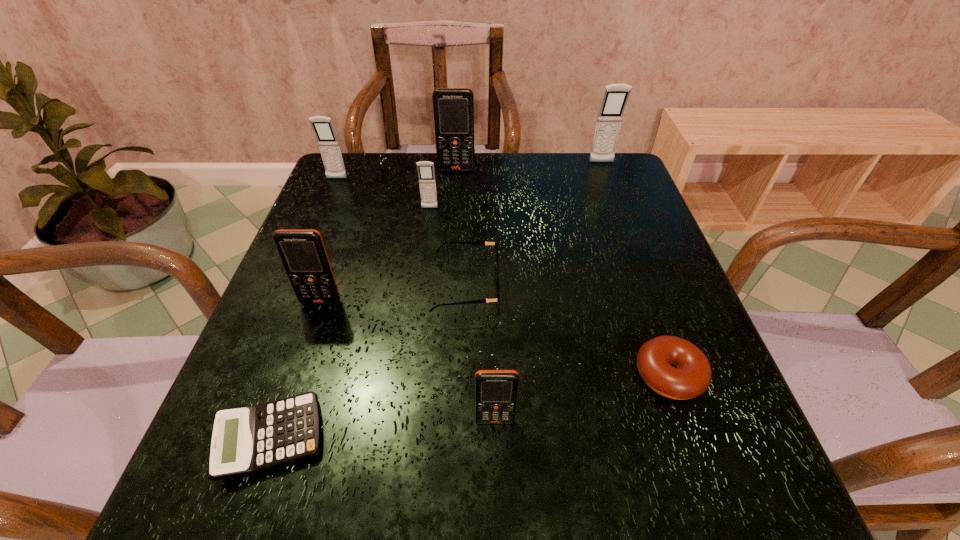
Identify the location of free area in between the chocolate doughnut and the farthest gray cellular telephone. The image size is (960, 540). (636, 269).

Where is `free spot between the farthest cellular telephone and the shortest object`? The height and width of the screenshot is (540, 960). free spot between the farthest cellular telephone and the shortest object is located at coordinates (436, 300).

Locate an element on the screen. Image resolution: width=960 pixels, height=540 pixels. free space between the fourth farthest object and the chocolate doughnut is located at coordinates (549, 292).

The width and height of the screenshot is (960, 540). In order to click on free space that is in between the spectacles and the shortest object in this screenshot , I will do `click(368, 362)`.

Identify the location of free spot between the third farthest cellular telephone and the doughnut. The height and width of the screenshot is (540, 960). (503, 277).

Where is `free space between the second farthest gray cellular telephone and the eighth nearest object`? free space between the second farthest gray cellular telephone and the eighth nearest object is located at coordinates (396, 174).

At what (x,y) coordinates should I click in order to perform the action: click on blank region between the leftmost gray cellular telephone and the second farthest cellular telephone. Please return your answer as a coordinate pair (x, y). The image size is (960, 540). Looking at the image, I should click on (396, 174).

Locate an element on the screen. The height and width of the screenshot is (540, 960). blank region between the second gray cellular telephone from left to right and the fourth nearest cellular telephone is located at coordinates (383, 193).

Find the location of `the fourth closest object to the farthest orange cellular telephone`. the fourth closest object to the farthest orange cellular telephone is located at coordinates (475, 243).

Find the location of a particular element. The width and height of the screenshot is (960, 540). object that is the seventh closest to the leftmost orange cellular telephone is located at coordinates (691, 375).